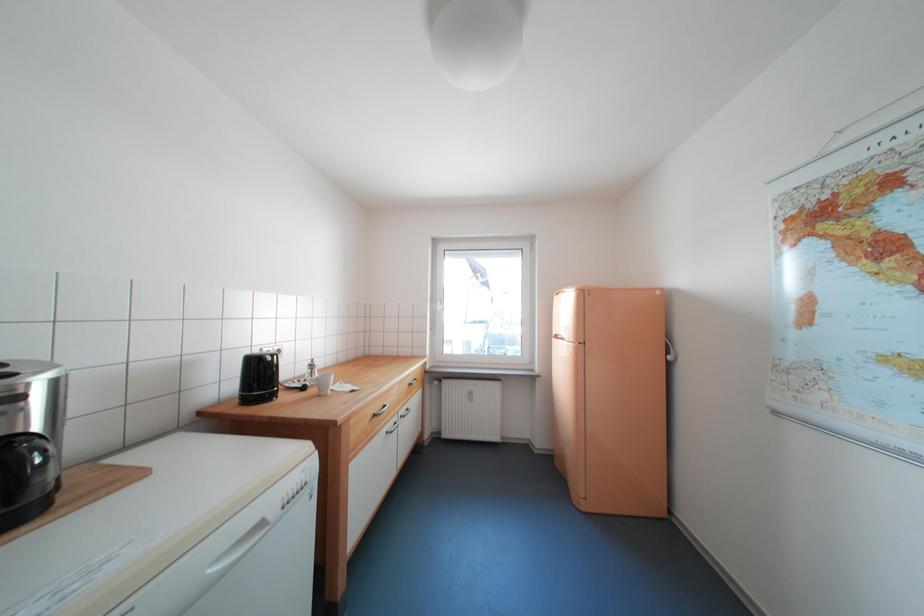
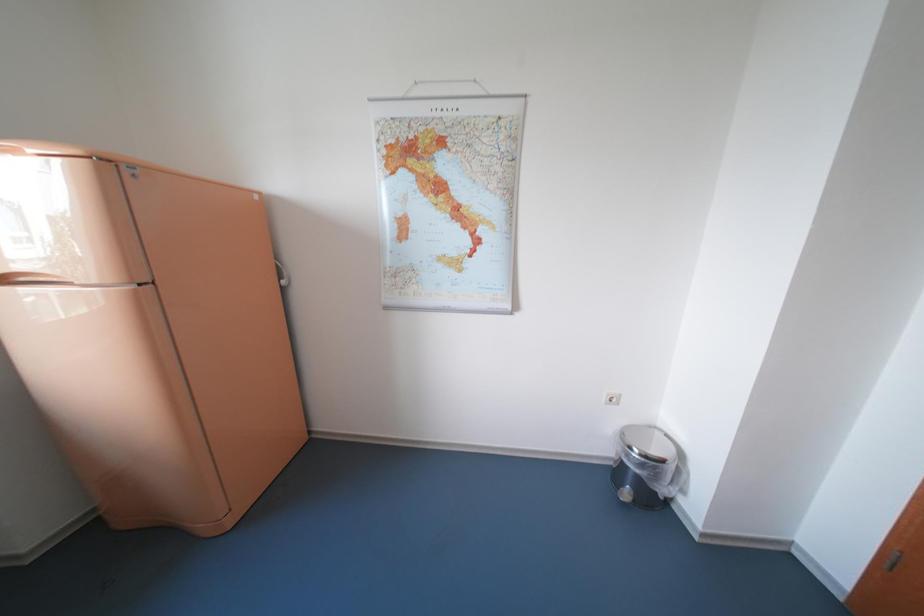
First-person continuous shooting, in which direction is the camera rotating?

The camera's rotation is toward right-down.